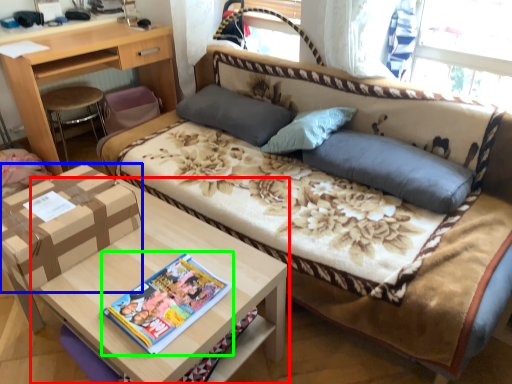
Question: Based on their relative distances, which object is nearer to table (highlighted by a red box)? Choose from cardboard box (highlighted by a blue box) and magazine (highlighted by a green box).

Choices:
 (A) cardboard box
 (B) magazine

Answer: (B)